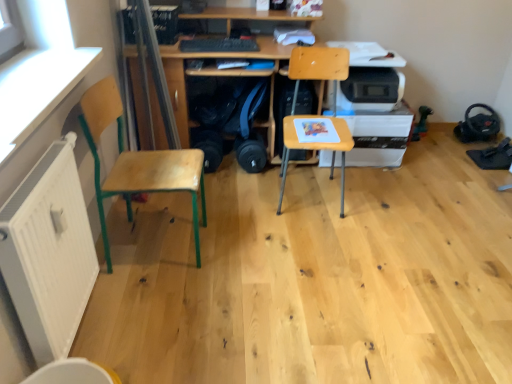
You are a GUI agent. You are given a task and a screenshot of the screen. Output one action in this format:
    pyautogui.click(x=<x>, y=<y>)
    Task: Click on the empty space that is in between wooden chair at center, arranged as the first chair when viewed from the right, and wooden at left, which ranks as the first chair in left-to-right order
    Image resolution: width=512 pixels, height=384 pixels.
    Given the screenshot: What is the action you would take?
    pyautogui.click(x=243, y=218)